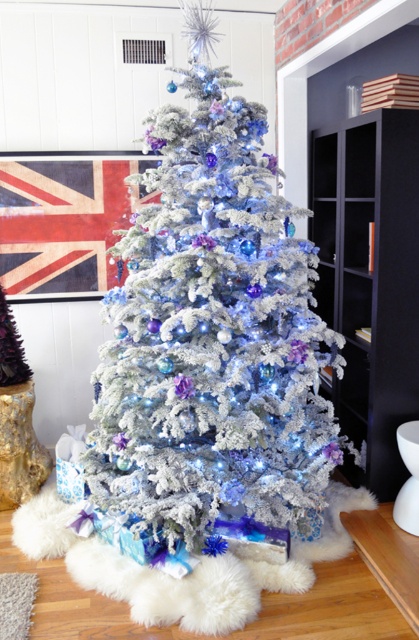
Question: Does frosted white christmas tree at center have a lesser width compared to black matte bookshelf at right?

Choices:
 (A) yes
 (B) no

Answer: (B)

Question: Can you confirm if frosted white christmas tree at center is positioned below black matte bookshelf at right?

Choices:
 (A) no
 (B) yes

Answer: (A)

Question: Which of the following is the closest to the observer?

Choices:
 (A) (233, 99)
 (B) (385, 198)

Answer: (A)

Question: Does frosted white christmas tree at center appear over black matte bookshelf at right?

Choices:
 (A) yes
 (B) no

Answer: (A)

Question: Among these objects, which one is farthest from the camera?

Choices:
 (A) black matte bookshelf at right
 (B) frosted white christmas tree at center

Answer: (A)